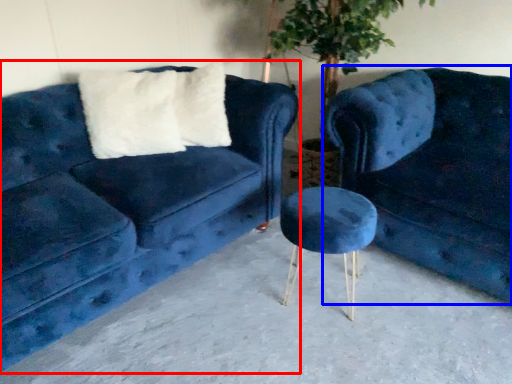
Question: Among these objects, which one is farthest to the camera, studio couch (highlighted by a red box) or studio couch (highlighted by a blue box)?

Choices:
 (A) studio couch
 (B) studio couch

Answer: (B)